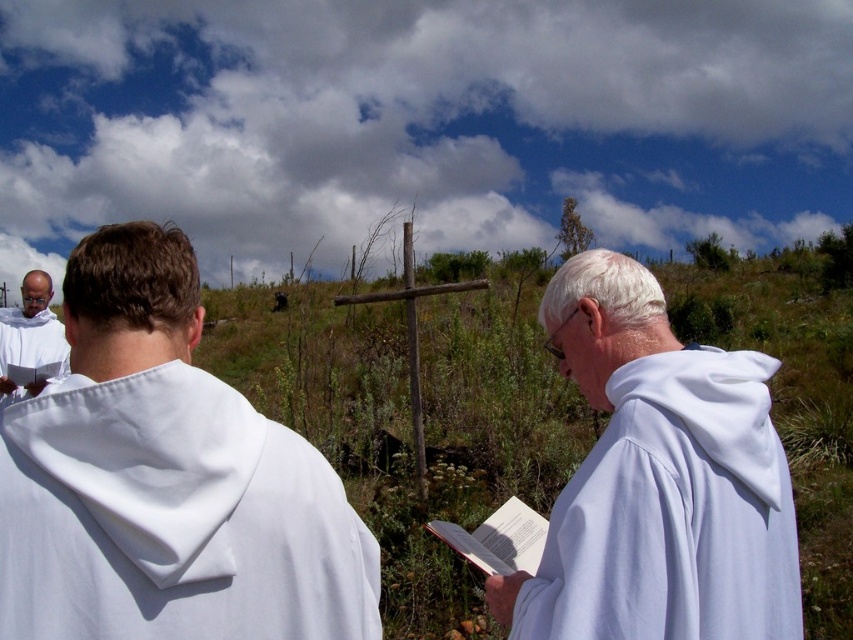
Is point (148, 412) positioned before point (0, 392)?

That is True.

Which is behind, point (57, 552) or point (61, 332)?

Positioned behind is point (61, 332).

Locate an element on the screen. white cloth at left is located at coordinates (166, 481).

Does white cloth at left have a larger size compared to white cloth book at center?

No.

Does point (218, 476) come closer to viewer compared to point (740, 385)?

Yes.

The height and width of the screenshot is (640, 853). I want to click on white cloth at left, so click(x=166, y=481).

Is white cloth book at center positioned before white clothed figure at left?

Yes, it is in front of white clothed figure at left.

Measure the distance from white cloth book at center to white clothed figure at left.

white cloth book at center is 18.49 feet from white clothed figure at left.

Find the location of a particular element. The height and width of the screenshot is (640, 853). white cloth book at center is located at coordinates (659, 481).